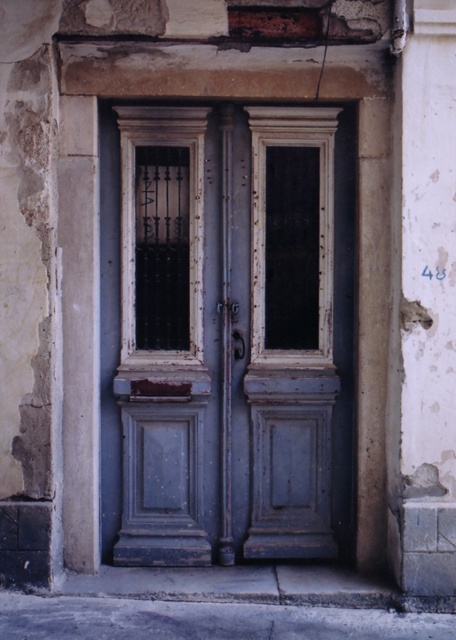
Question: In this image, where is rusty wood door at center located relative to white plaster pillar at right?

Choices:
 (A) below
 (B) above

Answer: (A)

Question: Considering the relative positions of rusty wood door at center and white plaster pillar at right in the image provided, where is rusty wood door at center located with respect to white plaster pillar at right?

Choices:
 (A) right
 (B) left

Answer: (B)

Question: Which point appears closest to the camera in this image?

Choices:
 (A) (433, 440)
 (B) (298, 394)

Answer: (A)

Question: Can you confirm if rusty wood door at center is positioned to the right of white plaster pillar at right?

Choices:
 (A) no
 (B) yes

Answer: (A)